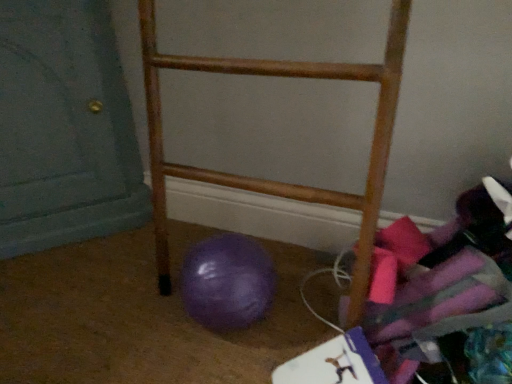
Image resolution: width=512 pixels, height=384 pixels. In order to click on vacant area that lies in front of purple rubber ball at lower left in this screenshot , I will do (x=220, y=359).